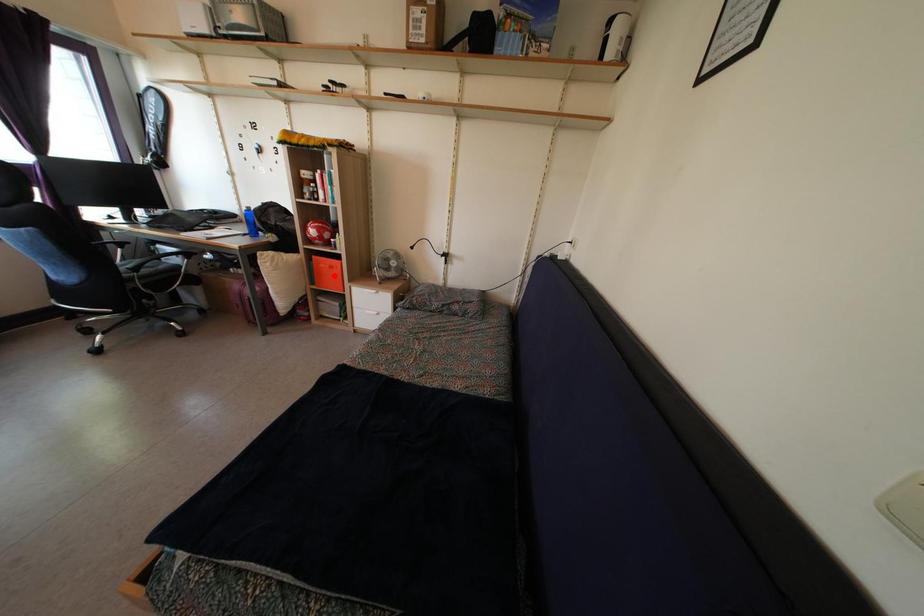
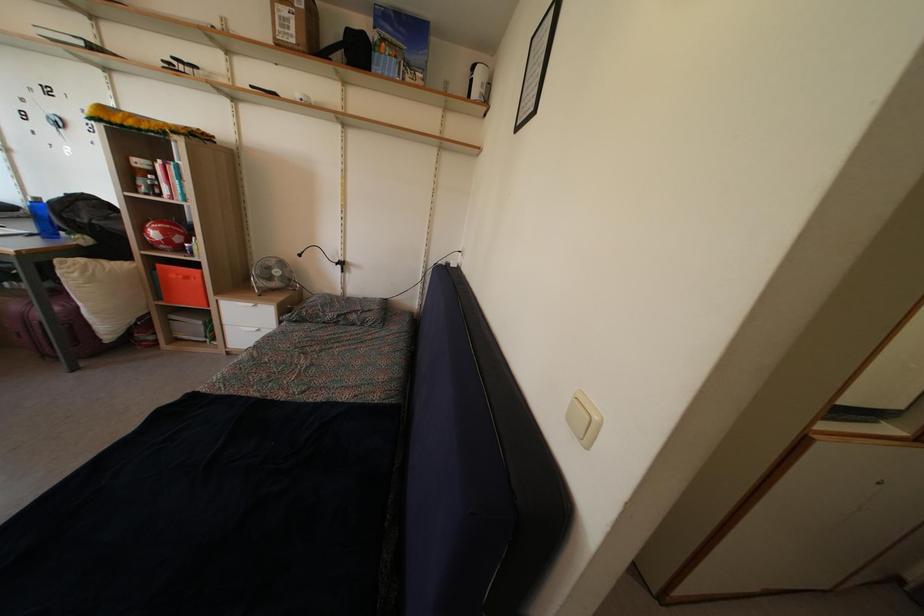
Find the pixel in the second image that matches the highlighted location in the first image.

(189, 286)